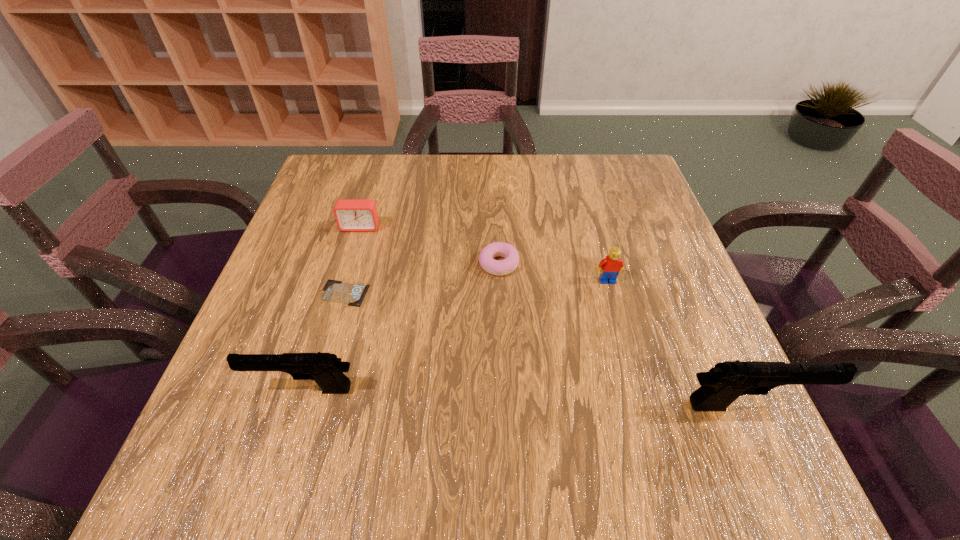
Find the location of `the left pistol`. the left pistol is located at coordinates 325,369.

Identify the location of the farther pistol. (325, 369).

Find the location of a particular element. This screenshot has width=960, height=540. the rightmost object is located at coordinates (720, 386).

Find the location of `the taller pistol`. the taller pistol is located at coordinates (720, 386).

Locate an element on the screen. This screenshot has height=540, width=960. identity card is located at coordinates (335, 291).

I want to click on the second shortest object, so click(495, 267).

Find the location of `pastry`. pastry is located at coordinates (495, 267).

Where is `the fourth tallest object`? the fourth tallest object is located at coordinates (351, 214).

The image size is (960, 540). In order to click on the farthest object in this screenshot , I will do `click(351, 214)`.

Locate an element on the screen. The height and width of the screenshot is (540, 960). the second object from right to left is located at coordinates click(610, 267).